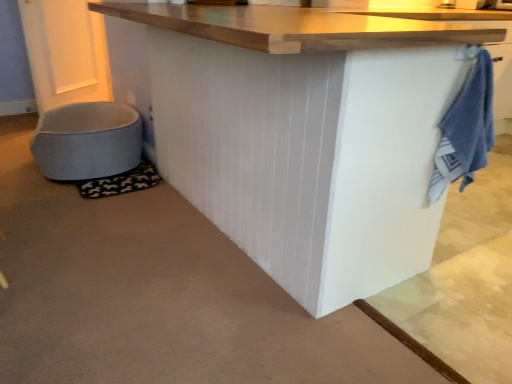
Question: From a real-world perspective, is light blue fabric pet bed at lower left positioned over white matte table at center based on gravity?

Choices:
 (A) no
 (B) yes

Answer: (A)

Question: Is the surface of light blue fabric pet bed at lower left in direct contact with white matte table at center?

Choices:
 (A) no
 (B) yes

Answer: (A)

Question: Are light blue fabric pet bed at lower left and white matte table at center far apart?

Choices:
 (A) no
 (B) yes

Answer: (A)

Question: Considering the relative positions of light blue fabric pet bed at lower left and white matte table at center in the image provided, is light blue fabric pet bed at lower left to the left of white matte table at center from the viewer's perspective?

Choices:
 (A) no
 (B) yes

Answer: (B)

Question: Can you confirm if light blue fabric pet bed at lower left is shorter than white matte table at center?

Choices:
 (A) no
 (B) yes

Answer: (B)

Question: Choose the correct answer: Is white matte table at center inside light blue fabric pet bed at lower left or outside it?

Choices:
 (A) inside
 (B) outside

Answer: (B)

Question: From the image's perspective, relative to light blue fabric pet bed at lower left, is white matte table at center above or below?

Choices:
 (A) below
 (B) above

Answer: (B)

Question: Looking at their shapes, would you say white matte table at center is wider or thinner than light blue fabric pet bed at lower left?

Choices:
 (A) thin
 (B) wide

Answer: (B)

Question: From a real-world perspective, is white matte table at center positioned above or below light blue fabric pet bed at lower left?

Choices:
 (A) above
 (B) below

Answer: (A)

Question: Relative to light blue fabric pet bed at lower left, is blue terry cloth towel at right in front or behind?

Choices:
 (A) front
 (B) behind

Answer: (A)

Question: Considering the positions of blue terry cloth towel at right and light blue fabric pet bed at lower left in the image, is blue terry cloth towel at right wider or thinner than light blue fabric pet bed at lower left?

Choices:
 (A) wide
 (B) thin

Answer: (B)

Question: Considering the relative positions of blue terry cloth towel at right and light blue fabric pet bed at lower left in the image provided, is blue terry cloth towel at right to the left or to the right of light blue fabric pet bed at lower left?

Choices:
 (A) right
 (B) left

Answer: (A)

Question: From their relative heights in the image, would you say blue terry cloth towel at right is taller or shorter than light blue fabric pet bed at lower left?

Choices:
 (A) tall
 (B) short

Answer: (A)

Question: In terms of height, does white matte table at center look taller or shorter compared to blue terry cloth towel at right?

Choices:
 (A) tall
 (B) short

Answer: (A)

Question: Is white matte table at center inside or outside of blue terry cloth towel at right?

Choices:
 (A) inside
 (B) outside

Answer: (B)